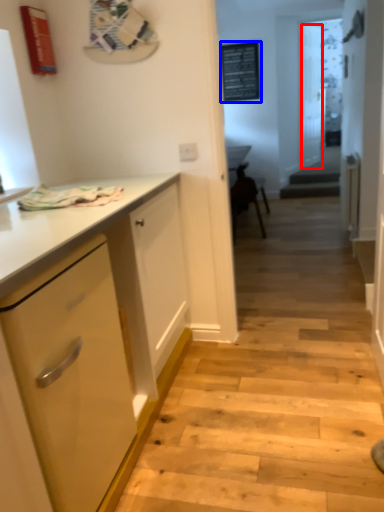
Question: Which point is closer to the camera, glass door (highlighted by a red box) or bulletin board (highlighted by a blue box)?

Choices:
 (A) glass door
 (B) bulletin board

Answer: (B)